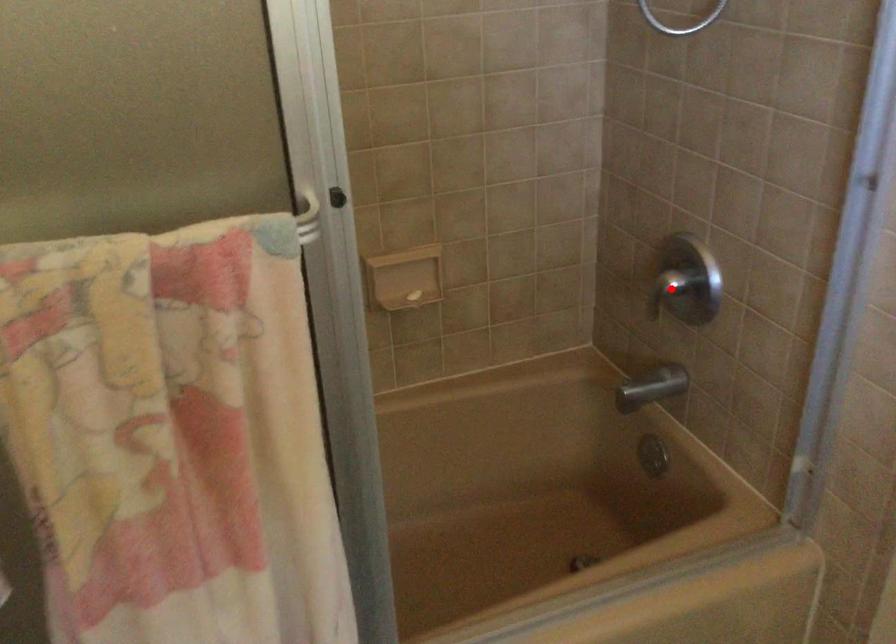
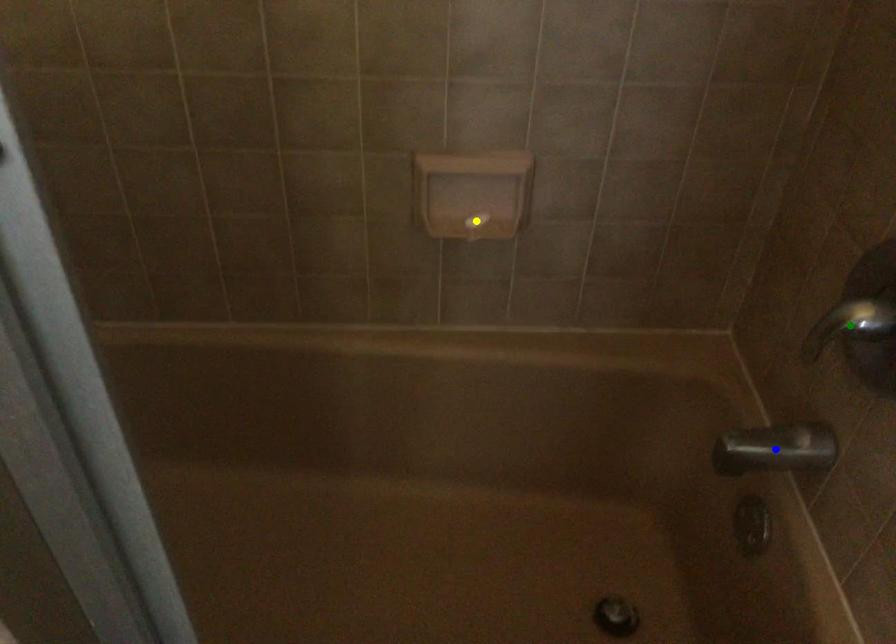
Question: I am providing you with two images of the same scene from different viewpoints. A red point is marked on the first image. You are given multiple points on the second image. Which mark in image 2 goes with the point in image 1?

Choices:
 (A) blue point
 (B) green point
 (C) yellow point

Answer: (B)